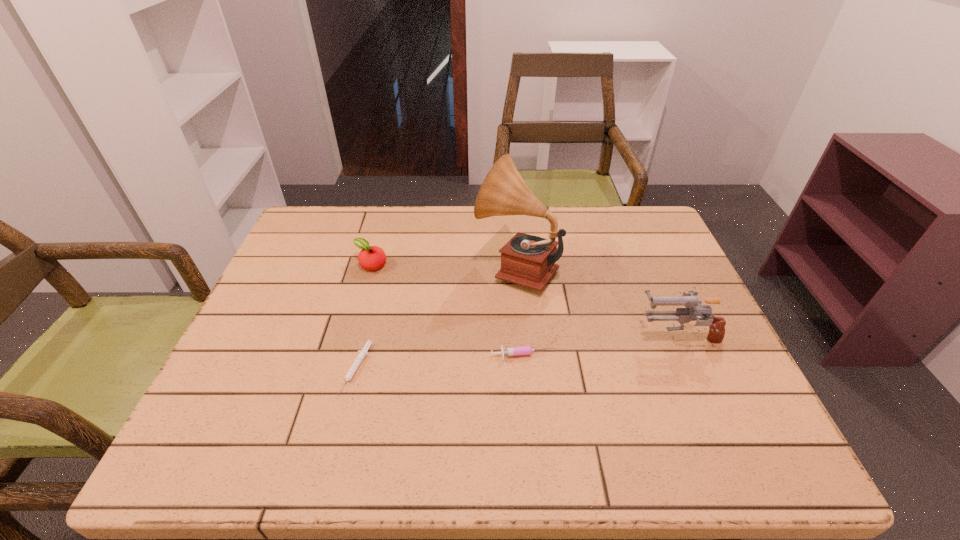
The image size is (960, 540). What are the coordinates of `vacant position located 0.060m on the horn of the phonograph record` in the screenshot? It's located at (453, 267).

Image resolution: width=960 pixels, height=540 pixels. Identify the location of vacant area situated 0.130m at the barrel end of the rightmost object. (582, 335).

This screenshot has width=960, height=540. In order to click on free region located at the barrel end of the rightmost object in this screenshot , I will do tap(603, 335).

Identify the location of blank space located at the barrel end of the rightmost object. (490, 335).

Where is `free space located on the right of the apple`? free space located on the right of the apple is located at coordinates (491, 265).

Where is `free space located 0.060m on the back of the right syringe`? The width and height of the screenshot is (960, 540). free space located 0.060m on the back of the right syringe is located at coordinates (521, 329).

Locate an element on the screen. This screenshot has width=960, height=540. blank space located 0.260m on the left of the shorter syringe is located at coordinates (229, 369).

Where is `object present at the far edge`? object present at the far edge is located at coordinates tap(527, 260).

Where is `object present at the right edge`? This screenshot has height=540, width=960. object present at the right edge is located at coordinates [x=694, y=308].

Where is `free space at the far edge`? free space at the far edge is located at coordinates (467, 217).